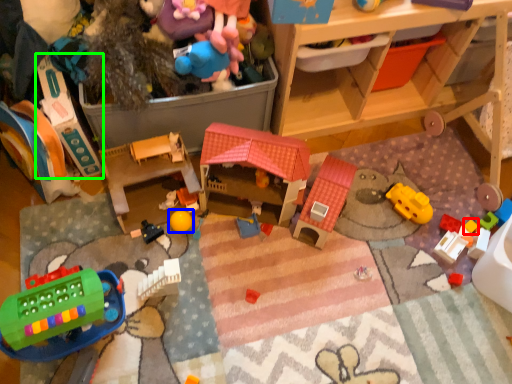
Question: Based on their relative distances, which object is farther from toy (highlighted by a red box)? Choose from toy (highlighted by a blue box) and toy (highlighted by a green box).

Choices:
 (A) toy
 (B) toy

Answer: (B)